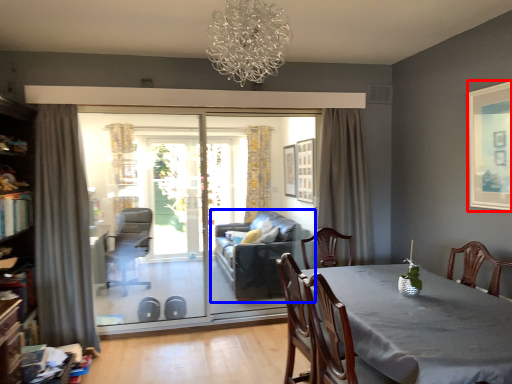
Question: Which of the following is the farthest to the observer, picture frame (highlighted by a red box) or studio couch (highlighted by a blue box)?

Choices:
 (A) picture frame
 (B) studio couch

Answer: (B)